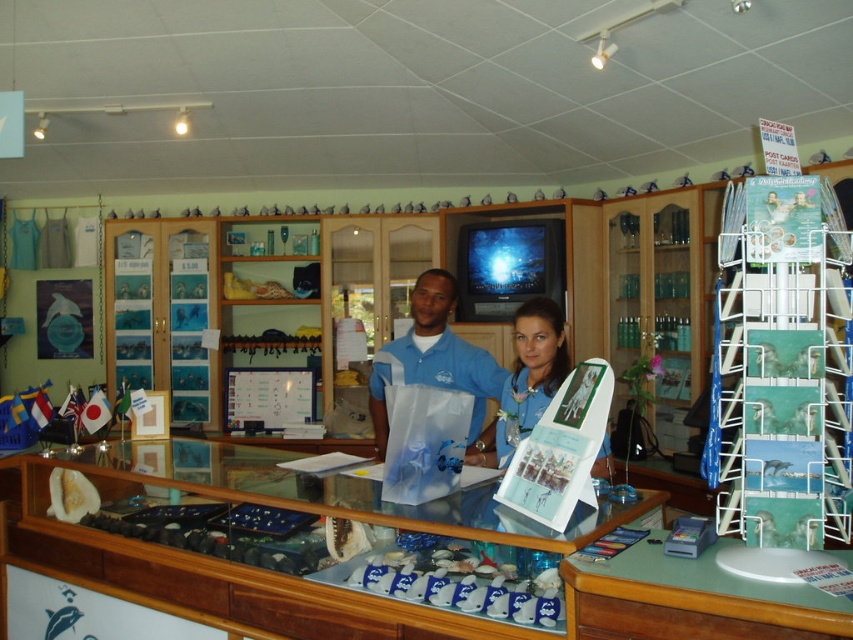
You are a customer looking at the shirts displayed on the counter in the souvenir shop. Which of the two shirts, the blue matte shirt at center or the blue fabric shirt at center, is positioned lower?

The blue matte shirt at center is positioned lower because it is below the blue fabric shirt at center.

You are a customer at the souvenir shop and want to pick up both the blue matte shirt at center and the blue fabric shirt at center from the counter. Which shirt should you reach for first if you want to grab the one that is closer to your left hand?

The blue matte shirt at center is positioned on the left side of blue fabric shirt at center, so you should reach for the blue matte shirt at center first as it is closer to your left hand.

You are a customer standing at the entrance of the souvenir shop. You see two points on the counter behind the staff members. Which point is closer to you, point (374, 426) or point (546, 333)?

Point (374, 426) is closer to you because it is further to the viewer than point (546, 333).